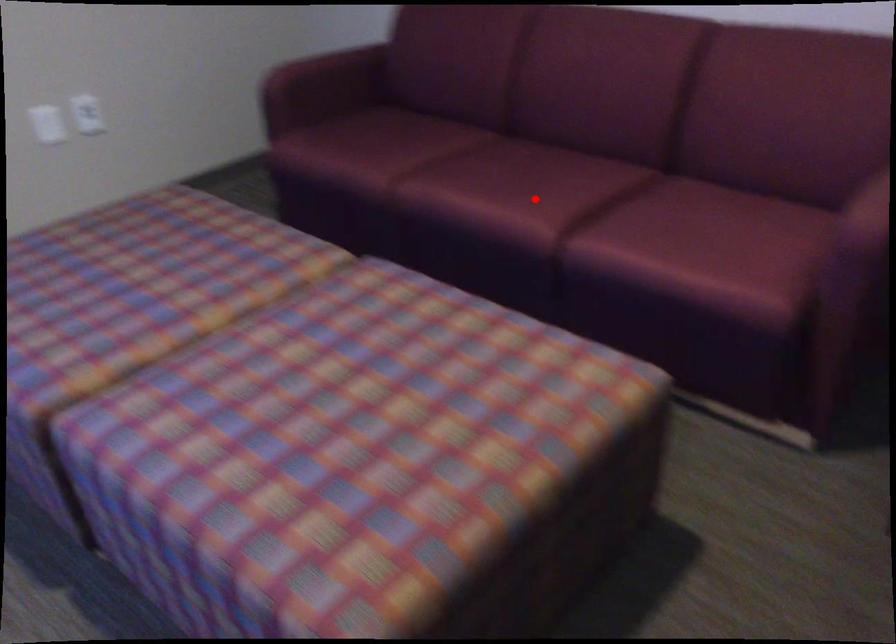
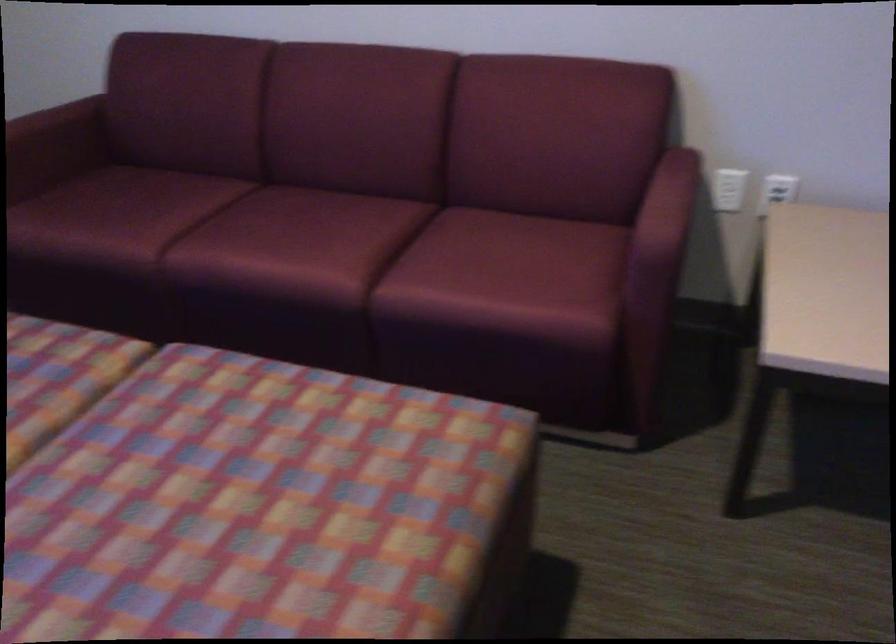
In the second image, find the point that corresponds to the highlighted location in the first image.

(332, 249)